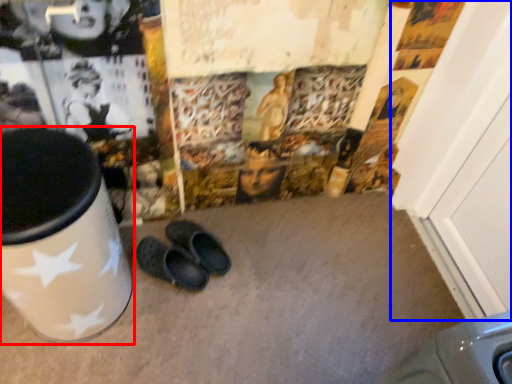
Question: Which point is closer to the camera, waste container (highlighted by a red box) or door (highlighted by a blue box)?

Choices:
 (A) waste container
 (B) door

Answer: (A)